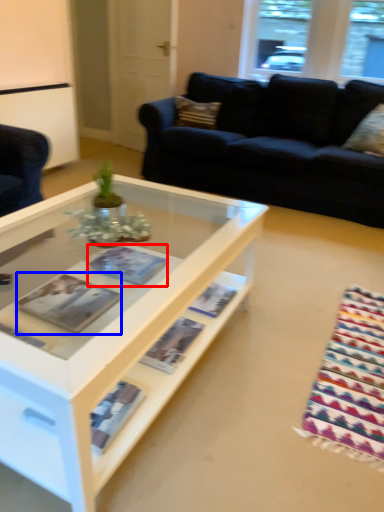
Question: Among these objects, which one is farthest to the camera, magazine (highlighted by a red box) or magazine (highlighted by a blue box)?

Choices:
 (A) magazine
 (B) magazine

Answer: (A)